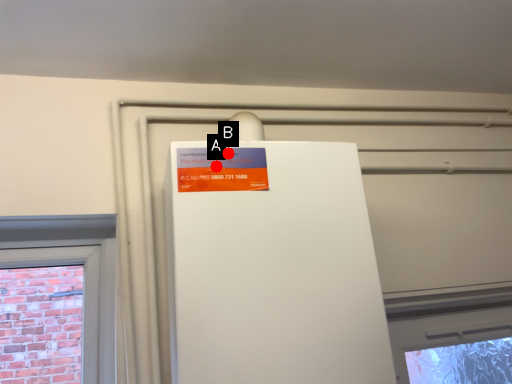
Question: Two points are circled on the image, labeled by A and B beside each circle. Which point appears closest to the camera in this image?

Choices:
 (A) A is closer
 (B) B is closer

Answer: (A)